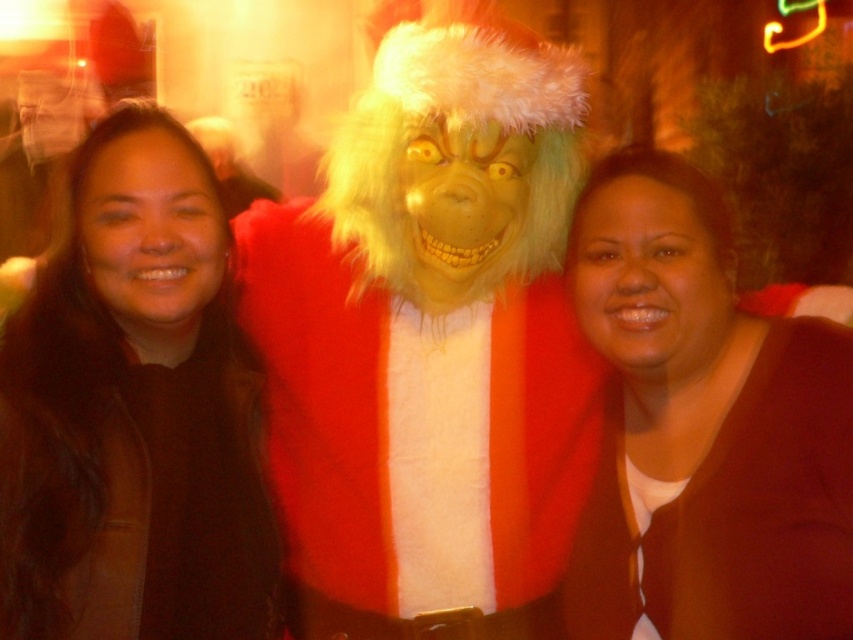
Does fuzzy red coat at center have a lesser width compared to dark brown leather jacket at center?

No, fuzzy red coat at center is not thinner than dark brown leather jacket at center.

Which is more to the right, fuzzy red coat at center or dark brown leather jacket at center?

From the viewer's perspective, fuzzy red coat at center appears more on the right side.

Measure the distance between point (305,292) and camera.

A distance of 5.34 feet exists between point (305,292) and camera.

Find the location of a particular element. fuzzy red coat at center is located at coordinates (430, 328).

Is dark brown leather jacket at center shorter than fuzzy red costume at center?

No.

Does dark brown leather jacket at center have a larger size compared to fuzzy red costume at center?

Yes, dark brown leather jacket at center is bigger than fuzzy red costume at center.

Who is more distant from viewer, [161,200] or [201,124]?

Positioned behind is point [201,124].

Locate an element on the screen. The width and height of the screenshot is (853, 640). dark brown leather jacket at center is located at coordinates (132, 412).

Is the position of brown matte jacket at lower right less distant than that of fuzzy red costume at center?

Yes, it is in front of fuzzy red costume at center.

Is point (622, 432) farther from viewer compared to point (202, 138)?

No, (622, 432) is closer to viewer.

Measure the distance between brown matte jacket at lower right and camera.

They are 4.30 feet apart.

This screenshot has width=853, height=640. Find the location of `brown matte jacket at lower right`. brown matte jacket at lower right is located at coordinates (703, 429).